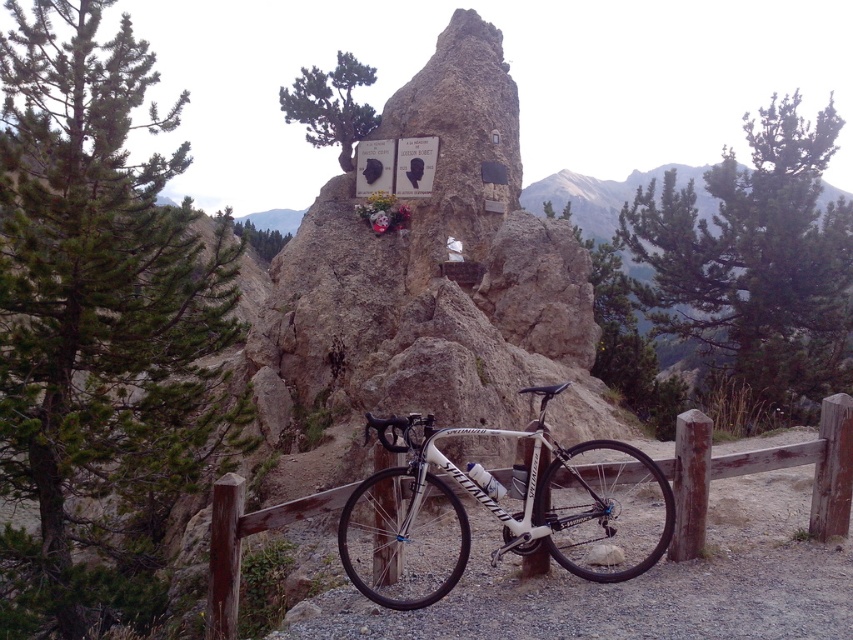
You are standing in the mountainous landscape and want to place a small flag exactly halfway between point (86, 58) and point (334, 497). Will the flag be closer to the viewer or further away compared to the two points?

The flag placed halfway between point (86, 58) and point (334, 497) will be closer to the viewer than point (334, 497) but further away than point (86, 58). Since point (86, 58) is closer to the viewer than point (334, 497), the midpoint would be between their distances.